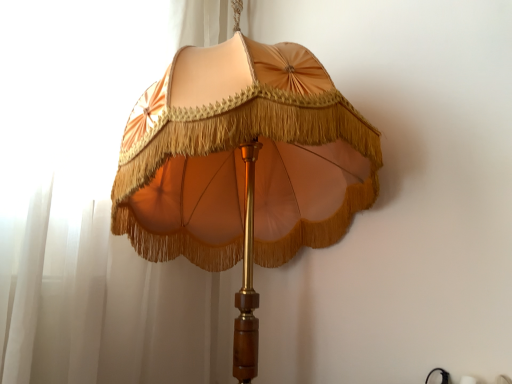
Where is `satin gold lampshade at center`? satin gold lampshade at center is located at coordinates (242, 165).

What do you see at coordinates (242, 165) in the screenshot? The image size is (512, 384). I see `satin gold lampshade at center` at bounding box center [242, 165].

Where is `satin gold lampshade at center`? The height and width of the screenshot is (384, 512). satin gold lampshade at center is located at coordinates 242,165.